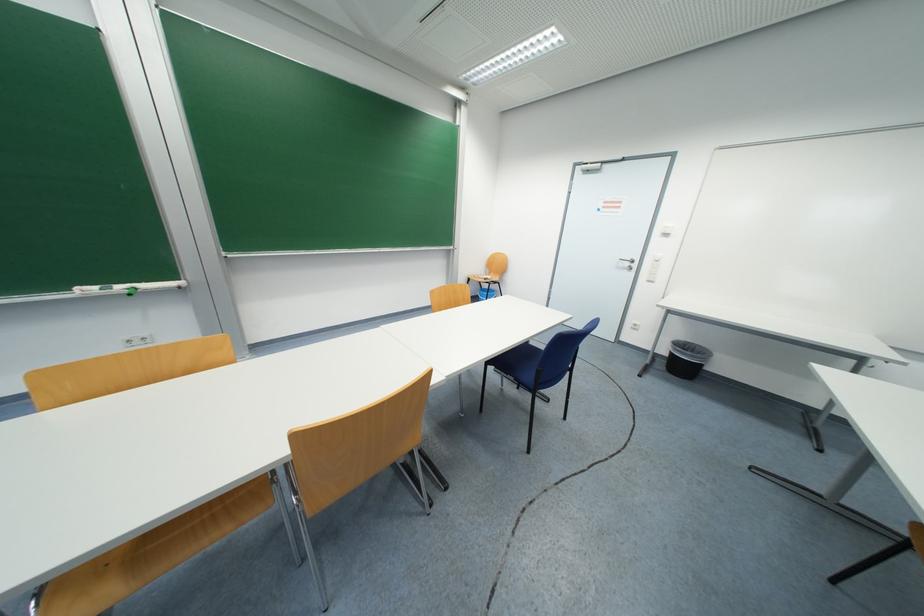
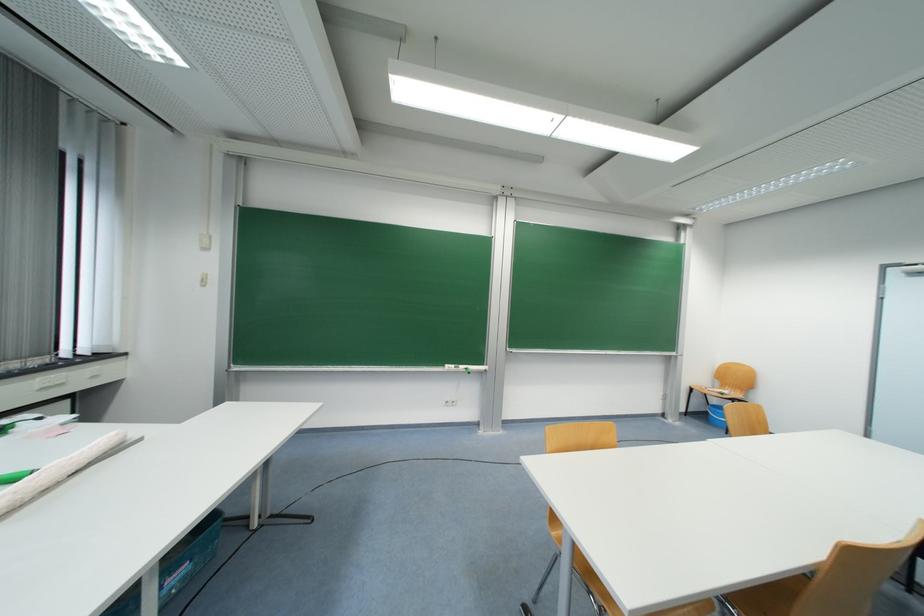
Find the pixel in the second image that matches pixel 502 281 in the first image.

(743, 398)